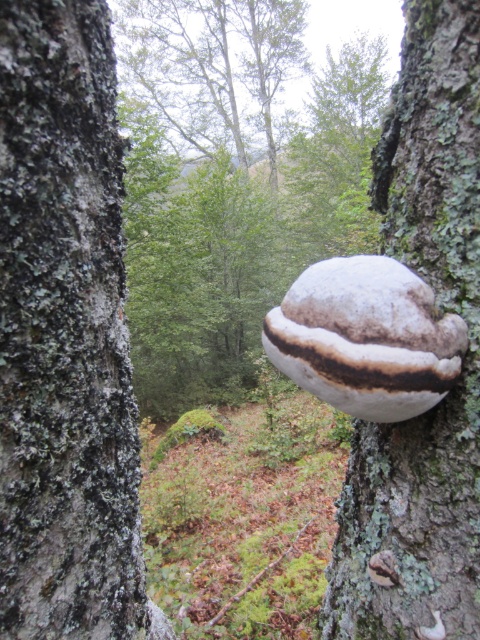
You are standing in front of the two tree trunks in the scene and want to place a small marker exactly where the white fuzzy fungus at center is located. According to the coordinates provided, what are the exact coordinates where you should place the marker?

The exact coordinates for placing the marker should be at point [231,182], as the white fuzzy fungus at center is located there.

You are an ecologist studying fungi in a forest. You notice two fungi in the scene. The first is the white fuzzy fungus at center and the second is the white matte fungus at right. Which one is positioned to the left of the other?

The white fuzzy fungus at center is positioned to the left of the white matte fungus at right.

You are an explorer in the forest and you see the smooth gray bark at center and the white fuzzy growth at center. Which object is located to the left of the other?

The smooth gray bark at center is positioned on the left side of white fuzzy growth at center.